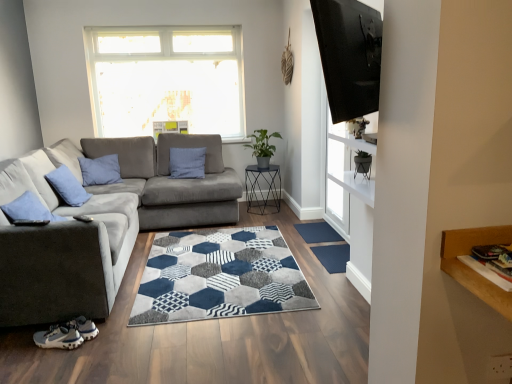
Question: Is the depth of metallic hexagonal table at center less than that of velvet blue pillow at left?

Choices:
 (A) yes
 (B) no

Answer: (B)

Question: From a real-world perspective, is metallic hexagonal table at center below velvet blue pillow at left?

Choices:
 (A) yes
 (B) no

Answer: (A)

Question: Is metallic hexagonal table at center smaller than velvet blue pillow at left?

Choices:
 (A) no
 (B) yes

Answer: (A)

Question: From the image's perspective, is metallic hexagonal table at center located beneath velvet blue pillow at left?

Choices:
 (A) yes
 (B) no

Answer: (A)

Question: Is metallic hexagonal table at center outside of velvet blue pillow at left?

Choices:
 (A) no
 (B) yes

Answer: (B)

Question: Relative to gray fabric couch at left, is blue rubber doormat at center, acting as the 2th doormat starting from the bottom, in front or behind?

Choices:
 (A) behind
 (B) front

Answer: (A)

Question: Is blue rubber doormat at center, the 1th doormat viewed from the top, bigger or smaller than gray fabric couch at left?

Choices:
 (A) small
 (B) big

Answer: (A)

Question: Is blue rubber doormat at center, arranged as the 2th doormat when viewed from the front, to the left or to the right of gray fabric couch at left in the image?

Choices:
 (A) left
 (B) right

Answer: (B)

Question: Is blue rubber doormat at center, arranged as the 2th doormat when viewed from the front, wider or thinner than gray fabric couch at left?

Choices:
 (A) wide
 (B) thin

Answer: (B)

Question: From the image's perspective, is transparent glass door at upper right located above or below black glossy tv at upper right?

Choices:
 (A) above
 (B) below

Answer: (B)

Question: Based on their positions, is transparent glass door at upper right located to the left or right of black glossy tv at upper right?

Choices:
 (A) right
 (B) left

Answer: (A)

Question: From their relative heights in the image, would you say transparent glass door at upper right is taller or shorter than black glossy tv at upper right?

Choices:
 (A) short
 (B) tall

Answer: (B)

Question: Considering the positions of transparent glass door at upper right and black glossy tv at upper right in the image, is transparent glass door at upper right wider or thinner than black glossy tv at upper right?

Choices:
 (A) thin
 (B) wide

Answer: (A)

Question: In terms of height, does blue textured doormat at center, the first doormat ordered from the bottom, look taller or shorter compared to velvet blue pillow at left?

Choices:
 (A) tall
 (B) short

Answer: (B)

Question: Looking at their shapes, would you say blue textured doormat at center, placed as the second doormat when sorted from top to bottom, is wider or thinner than velvet blue pillow at left?

Choices:
 (A) wide
 (B) thin

Answer: (A)